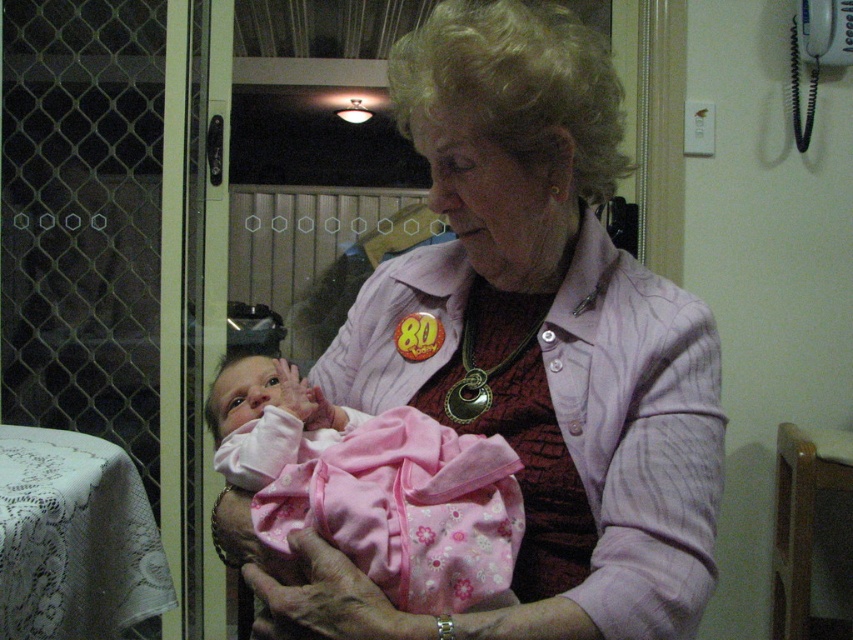
Between point (590, 253) and point (427, 550), which one is positioned in front?

Positioned in front is point (427, 550).

Does point (598, 180) come in front of point (456, 547)?

No, it is not.

Which is in front, point (467, 124) or point (421, 413)?

Point (467, 124) is more forward.

Locate an element on the screen. The height and width of the screenshot is (640, 853). pink fabric at center is located at coordinates (526, 349).